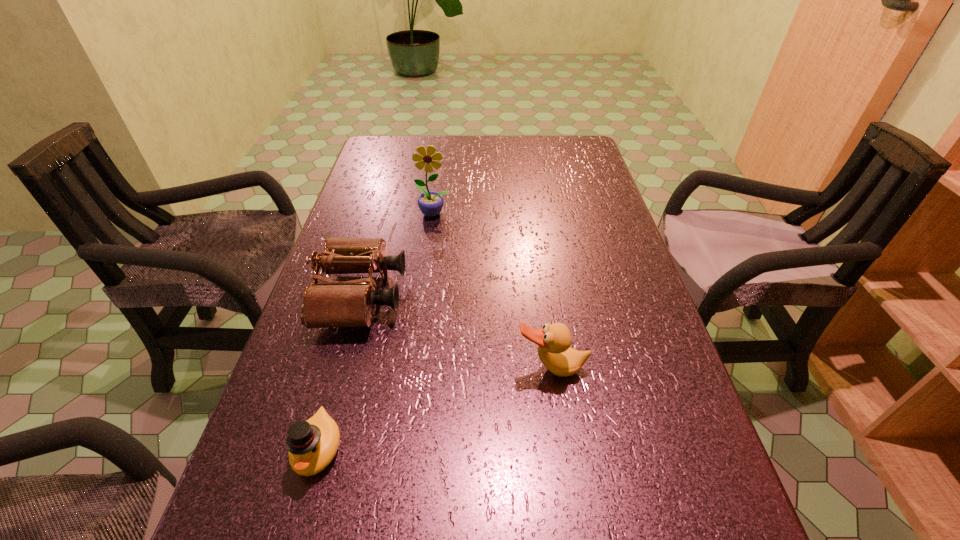
This screenshot has width=960, height=540. What are the coordinates of `vacant region that satisfies the following two spatial constraints: 1. on the front-facing side of the tallest object; 2. through the eyepieces of the second farthest object` in the screenshot? It's located at (423, 296).

Image resolution: width=960 pixels, height=540 pixels. Find the location of `vacant space that satisfies the following two spatial constraints: 1. through the eyepieces of the third nearest object; 2. on the front-facing side of the shortest object`. vacant space that satisfies the following two spatial constraints: 1. through the eyepieces of the third nearest object; 2. on the front-facing side of the shortest object is located at coordinates (319, 449).